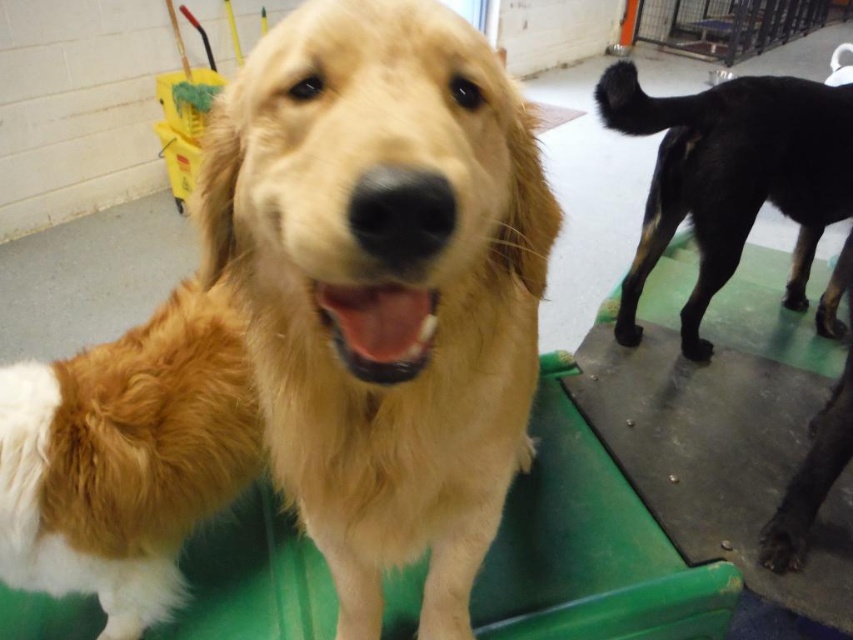
You are a veterinary assistant who needs to place a small toy between the two points, point[465,104] and point[821,147]. Which point should the toy be closer to to ensure it is in front of the other point?

The toy should be placed closer to point[465,104] because it is in front of point[821,147].

You are a vet assistant who needs to lead the golden fur dog at center and the black glossy dog at right to separate examination rooms. Since the rooms are narrow, you must determine their positions relative to each other. Which dog is on the left side when facing the direction of the rooms?

The golden fur dog at center is positioned on the left side of the black glossy dog at right, so when facing the direction of the rooms, the golden fur dog at center will be on the left side.